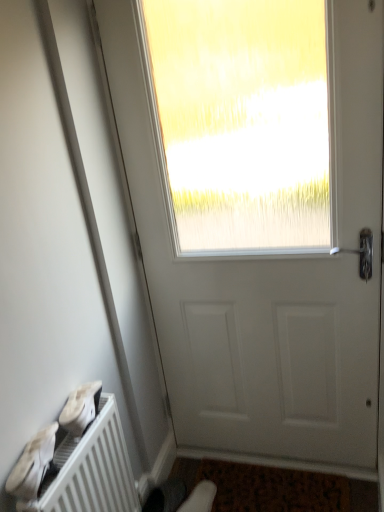
Question: Is white matte shoe at lower left, which is the second shoe from back to front, located outside white matte door at center?

Choices:
 (A) no
 (B) yes

Answer: (B)

Question: Is white matte shoe at lower left, marked as the first shoe in a top-to-bottom arrangement, positioned with its back to white matte door at center?

Choices:
 (A) no
 (B) yes

Answer: (A)

Question: Is white matte shoe at lower left, which is the second shoe from back to front, wider than white matte door at center?

Choices:
 (A) yes
 (B) no

Answer: (B)

Question: Is white matte shoe at lower left, which is the second shoe from back to front, positioned before white matte door at center?

Choices:
 (A) no
 (B) yes

Answer: (A)

Question: Can you confirm if white matte shoe at lower left, positioned as the second shoe in right-to-left order, is bigger than white matte door at center?

Choices:
 (A) yes
 (B) no

Answer: (B)

Question: From a real-world perspective, is white matte shoe at lower left, the third shoe positioned from the right, positioned above or below white matte shoe at lower left, which is the second shoe from back to front?

Choices:
 (A) above
 (B) below

Answer: (A)

Question: Is white matte shoe at lower left, marked as the 1th shoe in a front-to-back arrangement, wider or thinner than white matte shoe at lower left, marked as the first shoe in a top-to-bottom arrangement?

Choices:
 (A) wide
 (B) thin

Answer: (B)

Question: Based on their sizes in the image, would you say white matte shoe at lower left, the 1th shoe from the left, is bigger or smaller than white matte shoe at lower left, marked as the first shoe in a top-to-bottom arrangement?

Choices:
 (A) small
 (B) big

Answer: (B)

Question: Is white matte shoe at lower left, marked as the 1th shoe in a front-to-back arrangement, in front of or behind white matte shoe at lower left, which ranks as the 2th shoe in front-to-back order, in the image?

Choices:
 (A) behind
 (B) front

Answer: (B)

Question: Choose the correct answer: Is white matte door at center inside white matte shoe at lower left, the 2th shoe in the left-to-right sequence, or outside it?

Choices:
 (A) outside
 (B) inside

Answer: (A)

Question: From their relative heights in the image, would you say white matte door at center is taller or shorter than white matte shoe at lower left, which is the second shoe from back to front?

Choices:
 (A) tall
 (B) short

Answer: (A)

Question: In terms of size, does white matte door at center appear bigger or smaller than white matte shoe at lower left, positioned as the second shoe in right-to-left order?

Choices:
 (A) small
 (B) big

Answer: (B)

Question: Is point (230, 323) positioned closer to the camera than point (77, 415)?

Choices:
 (A) farther
 (B) closer

Answer: (A)

Question: From the image's perspective, is white matte shoe at lower left, which is the second shoe in top-to-bottom order, above or below white matte door at center?

Choices:
 (A) below
 (B) above

Answer: (A)

Question: Considering their positions, is white matte shoe at lower left, the 3th shoe from the back, located in front of or behind white matte door at center?

Choices:
 (A) front
 (B) behind

Answer: (A)